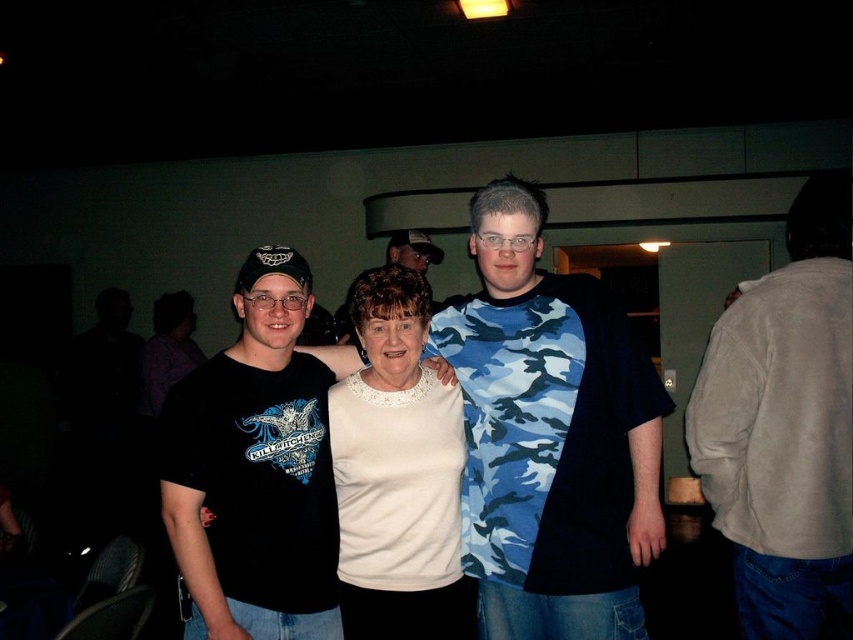
Does blue camouflage shirt at center appear under white lace sweater at center?

Actually, blue camouflage shirt at center is above white lace sweater at center.

Consider the image. Which is more to the left, blue camouflage shirt at center or white lace sweater at center?

white lace sweater at center

Image resolution: width=853 pixels, height=640 pixels. In order to click on blue camouflage shirt at center in this screenshot , I will do `click(550, 435)`.

This screenshot has height=640, width=853. In order to click on blue camouflage shirt at center in this screenshot , I will do `click(550, 435)`.

Between blue camouflage shirt at center and white fleece jacket at right, which one is positioned lower?

blue camouflage shirt at center is below.

Who is more forward, (x=606, y=595) or (x=747, y=340)?

Positioned in front is point (x=606, y=595).

The height and width of the screenshot is (640, 853). In order to click on blue camouflage shirt at center in this screenshot , I will do `click(550, 435)`.

Between black matte t-shirt at left and white lace sweater at center, which one appears on the left side from the viewer's perspective?

black matte t-shirt at left

This screenshot has height=640, width=853. Describe the element at coordinates (254, 470) in the screenshot. I see `black matte t-shirt at left` at that location.

Does point (207, 488) lie behind point (386, 576)?

No, (207, 488) is closer to viewer.

The image size is (853, 640). I want to click on black matte t-shirt at left, so pyautogui.click(x=254, y=470).